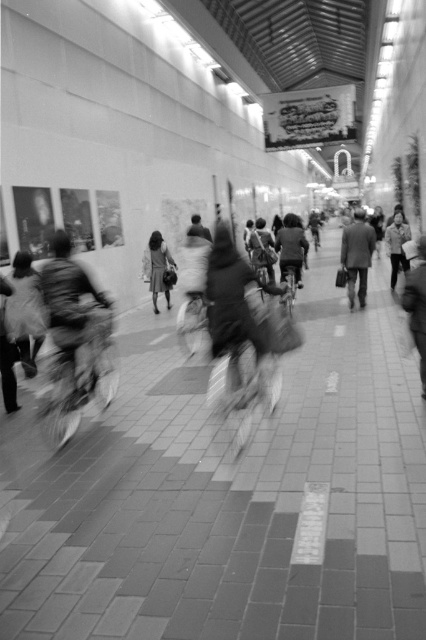
This screenshot has height=640, width=426. What are the coordinates of `matte black coat at center` in the screenshot? It's located at (158, 268).

Can you confirm if matte black coat at center is smaller than matte gray jacket at center?

Yes, matte black coat at center is smaller than matte gray jacket at center.

Is point (154, 272) closer to viewer compared to point (298, 236)?

No, it is not.

Locate an element on the screen. This screenshot has height=640, width=426. matte black coat at center is located at coordinates (158, 268).

Is matte fabric backpack at center thinner than matte gray jacket at center?

Yes, matte fabric backpack at center is thinner than matte gray jacket at center.

Between matte fabric backpack at center and matte gray jacket at center, which one is positioned higher?

matte gray jacket at center is above.

Is point (62, 332) in front of point (282, 221)?

Yes.

You are a GUI agent. You are given a task and a screenshot of the screen. Output one action in this format:
    pyautogui.click(x=<x>, y=<y>)
    Task: Click on the matte fabric backpack at center
    The height and width of the screenshot is (640, 426).
    Given the screenshot: What is the action you would take?
    pyautogui.click(x=74, y=317)

Who is lower down, smooth fabric bag at left or dark gray suit at center?

smooth fabric bag at left is lower down.

Is point (26, 333) behind point (363, 237)?

That is False.

Where is `smooth fabric bag at left`? This screenshot has height=640, width=426. smooth fabric bag at left is located at coordinates (25, 312).

Where is `smooth fabric bag at left`? Image resolution: width=426 pixels, height=640 pixels. smooth fabric bag at left is located at coordinates (25, 312).